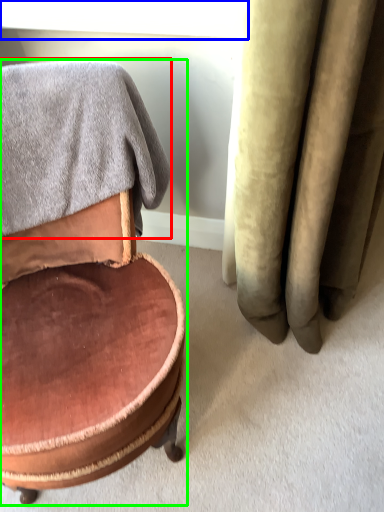
Question: Estimate the real-world distances between objects in this image. Which object is closer to bath towel (highlighted by a red box), window screen (highlighted by a blue box) or chair (highlighted by a green box)?

Choices:
 (A) window screen
 (B) chair

Answer: (B)